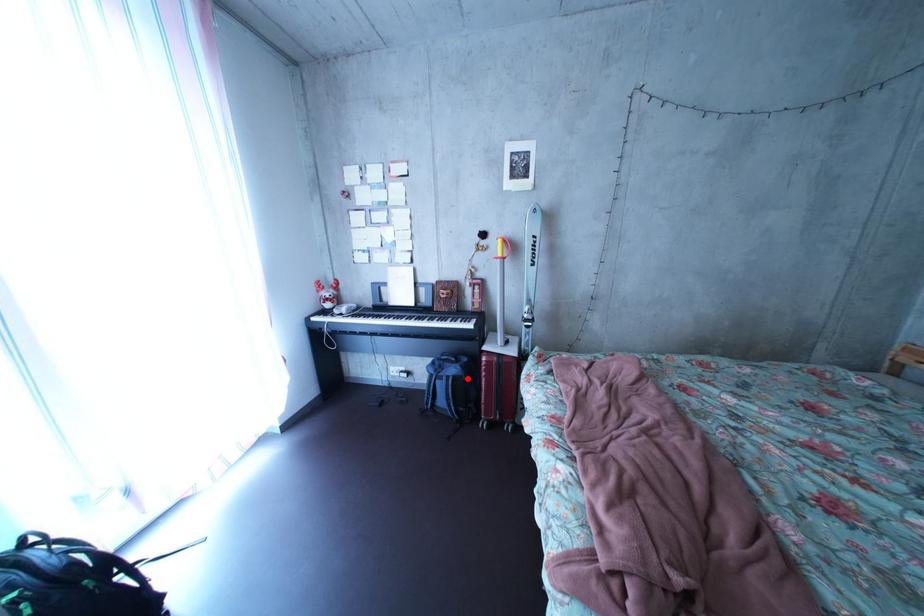
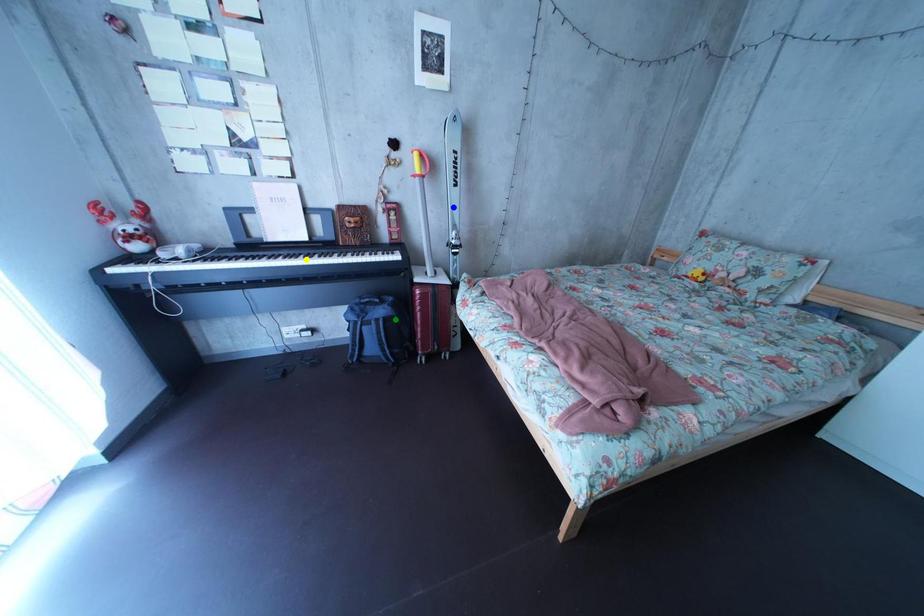
Question: I am providing you with two images of the same scene from different viewpoints. A red point is marked on the first image. You are given multiple points on the second image. Which point in image 2 is actually the same real-world point as the red point in image 1?

Choices:
 (A) green point
 (B) yellow point
 (C) blue point

Answer: (A)